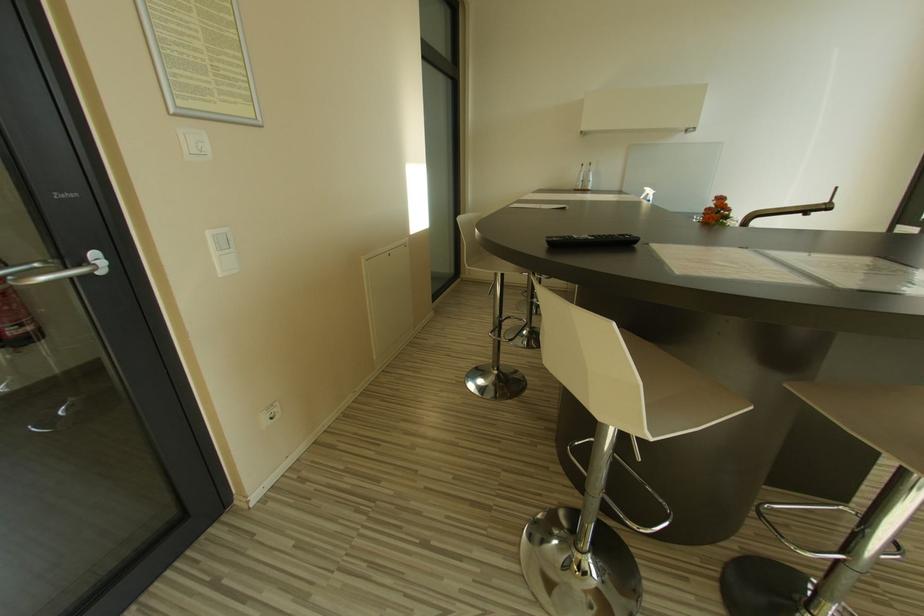
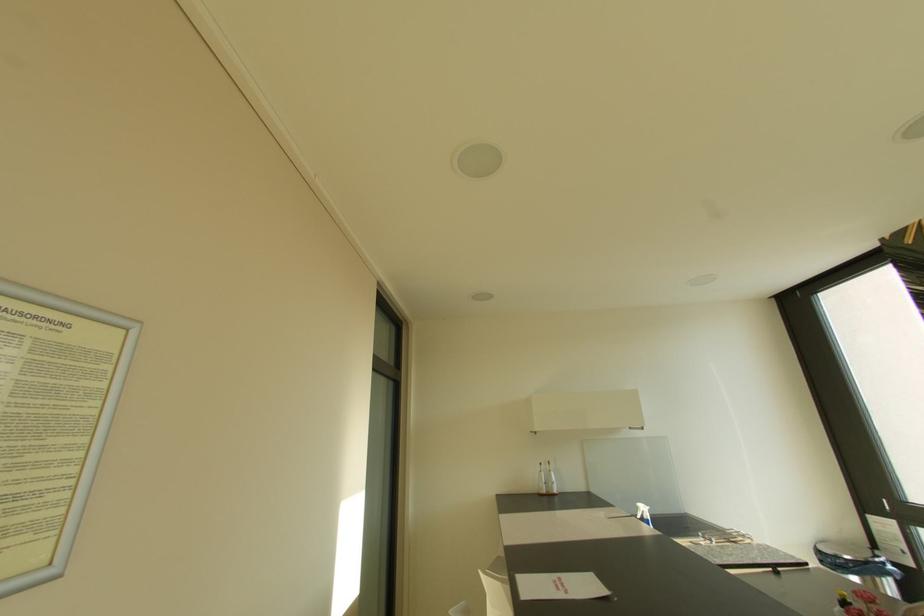
The first image is from the beginning of the video and the second image is from the end. How did the camera likely rotate when shooting the video?

The rotation direction of the camera is right-up.